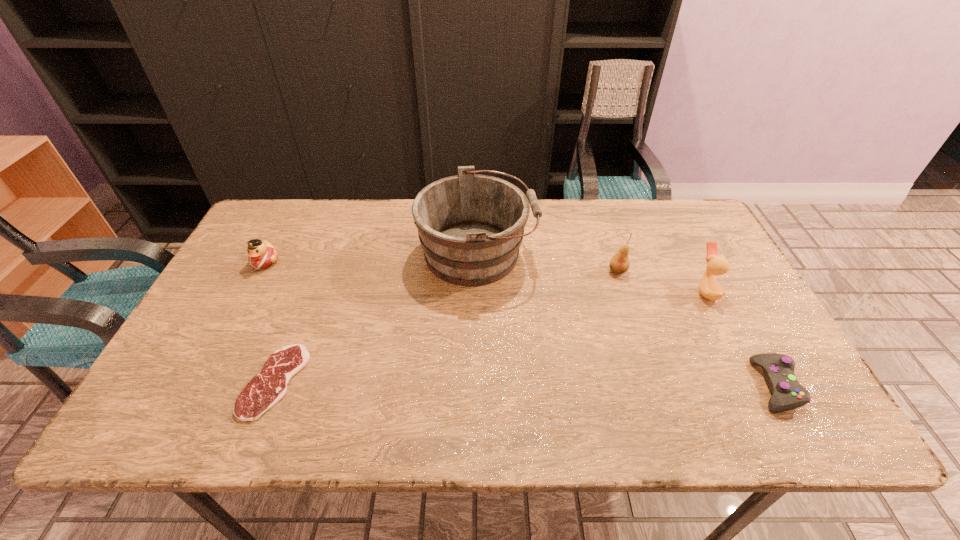
Where is `wine bucket`? wine bucket is located at coordinates (470, 226).

This screenshot has width=960, height=540. What are the coordinates of `the tallest object` in the screenshot? It's located at (470, 226).

Locate an element on the screen. This screenshot has height=540, width=960. the fourth object from left to right is located at coordinates (619, 263).

I want to click on the nearer duck, so click(x=709, y=288).

Where is `the right duck`? The width and height of the screenshot is (960, 540). the right duck is located at coordinates (709, 288).

Find the location of a particular element. the fourth tallest object is located at coordinates pos(262,254).

The width and height of the screenshot is (960, 540). In order to click on the farther duck in this screenshot , I will do `click(262, 254)`.

Find the location of a particular element. This screenshot has width=960, height=540. the fifth tallest object is located at coordinates (778, 369).

In order to click on the second object from left to right in this screenshot , I will do `click(269, 386)`.

Image resolution: width=960 pixels, height=540 pixels. Find the location of `steak`. steak is located at coordinates (269, 386).